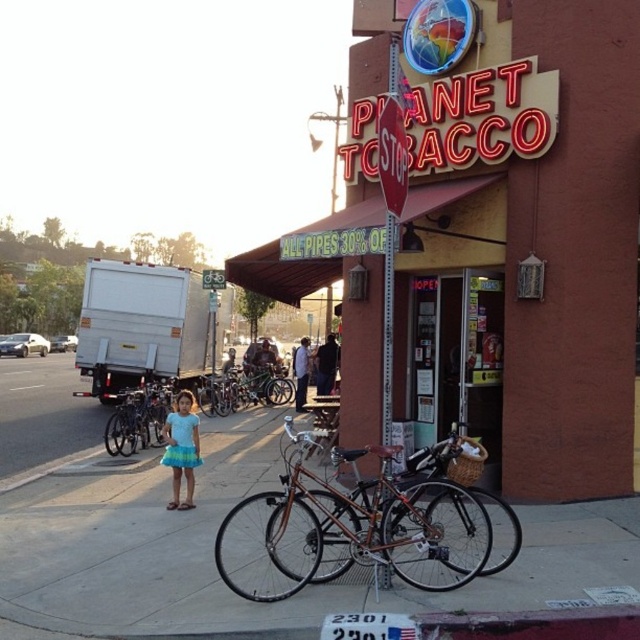
Describe the element at coordinates (528, 248) in the screenshot. I see `brick building at center` at that location.

The width and height of the screenshot is (640, 640). Find the location of `brick building at center`. brick building at center is located at coordinates (528, 248).

The image size is (640, 640). In order to click on shiny metallic bicycle at center in this screenshot , I will do [360, 528].

Can you confirm if smooth concrete sidewalk at center is wider than shiny black bicycle at center?

Correct, the width of smooth concrete sidewalk at center exceeds that of shiny black bicycle at center.

Can you confirm if smooth concrete sidewalk at center is positioned to the right of shiny black bicycle at center?

Indeed, smooth concrete sidewalk at center is positioned on the right side of shiny black bicycle at center.

Identify the location of smooth concrete sidewalk at center. (211, 550).